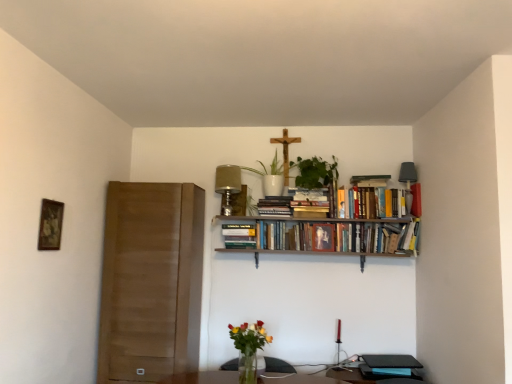
Question: Can you confirm if hardcover book at upper right, the 1th book when ordered from right to left, is taller than hardcover books at upper center, the 2th book in the right-to-left sequence?

Choices:
 (A) yes
 (B) no

Answer: (A)

Question: Does hardcover book at upper right, which is counted as the fifth book, starting from the left, have a larger size compared to hardcover books at upper center, positioned as the fourth book in left-to-right order?

Choices:
 (A) yes
 (B) no

Answer: (B)

Question: Is hardcover book at upper right, which is counted as the fifth book, starting from the left, shorter than hardcover books at upper center, positioned as the fourth book in left-to-right order?

Choices:
 (A) no
 (B) yes

Answer: (A)

Question: Is hardcover book at upper right, the 1th book when ordered from right to left, turned away from hardcover books at upper center, the 2th book in the right-to-left sequence?

Choices:
 (A) yes
 (B) no

Answer: (B)

Question: Can you confirm if hardcover book at upper right, which is counted as the fifth book, starting from the left, is positioned to the left of hardcover books at upper center, the 2th book in the right-to-left sequence?

Choices:
 (A) no
 (B) yes

Answer: (A)

Question: Based on their positions, is hardcover books at upper center, positioned as the fourth book in left-to-right order, located to the left or right of hardcover books at upper center, which is the third book from right to left?

Choices:
 (A) right
 (B) left

Answer: (A)

Question: Does point (374, 180) appear closer or farther from the camera than point (397, 203)?

Choices:
 (A) farther
 (B) closer

Answer: (A)

Question: In terms of height, does hardcover books at upper center, positioned as the fourth book in left-to-right order, look taller or shorter compared to hardcover books at upper center, which is the third book from right to left?

Choices:
 (A) tall
 (B) short

Answer: (B)

Question: From a real-world perspective, is hardcover books at upper center, positioned as the fourth book in left-to-right order, above or below hardcover books at upper center, which ranks as the 3th book in left-to-right order?

Choices:
 (A) below
 (B) above

Answer: (B)

Question: Considering their positions, is green leafy plant at upper center, which appears as the second plant when viewed from the left, located in front of or behind white ceramic pot at upper center, placed as the first plant when sorted from left to right?

Choices:
 (A) front
 (B) behind

Answer: (A)

Question: In terms of size, does green leafy plant at upper center, the 1th plant positioned from the right, appear bigger or smaller than white ceramic pot at upper center, placed as the first plant when sorted from left to right?

Choices:
 (A) small
 (B) big

Answer: (B)

Question: Does point (334, 165) appear closer or farther from the camera than point (274, 192)?

Choices:
 (A) closer
 (B) farther

Answer: (B)

Question: From their relative heights in the image, would you say green leafy plant at upper center, the 1th plant positioned from the right, is taller or shorter than white ceramic pot at upper center, placed as the first plant when sorted from left to right?

Choices:
 (A) tall
 (B) short

Answer: (B)

Question: Is point (415, 196) closer or farther from the camera than point (391, 205)?

Choices:
 (A) farther
 (B) closer

Answer: (A)

Question: Considering the positions of hardcover book at upper right, the 1th book when ordered from right to left, and hardcover books at upper center, which ranks as the 3th book in left-to-right order, in the image, is hardcover book at upper right, the 1th book when ordered from right to left, taller or shorter than hardcover books at upper center, which ranks as the 3th book in left-to-right order,?

Choices:
 (A) tall
 (B) short

Answer: (B)